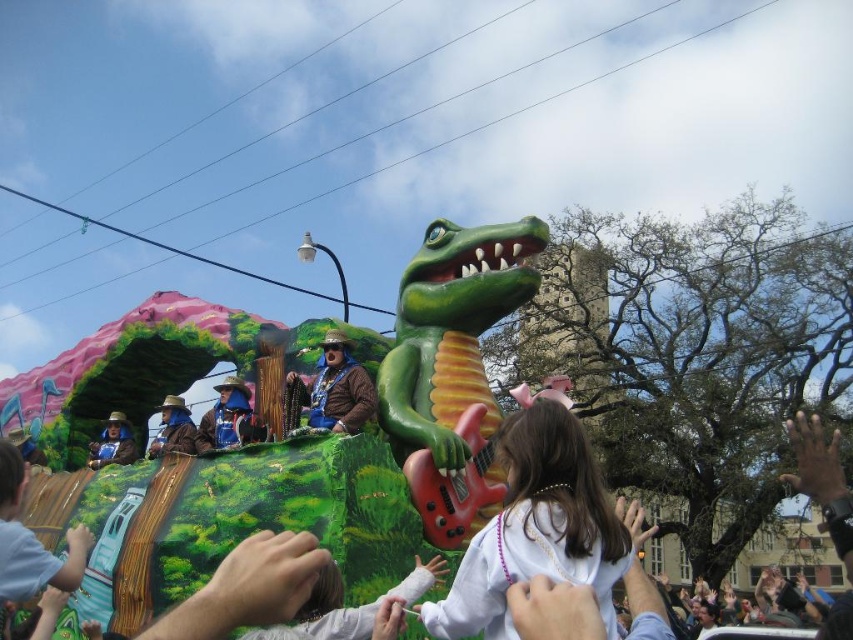
Is blue fabric hat at center to the right of blue velvet hat at center from the viewer's perspective?

Correct, you'll find blue fabric hat at center to the right of blue velvet hat at center.

Does blue fabric hat at center have a smaller size compared to blue velvet hat at center?

Yes.

At what (x,y) coordinates should I click in order to perform the action: click on blue fabric hat at center. Please return your answer as a coordinate pair (x, y). Image resolution: width=853 pixels, height=640 pixels. Looking at the image, I should click on (225, 417).

Is brown leather jacket at center closer to the viewer compared to blue fabric hat at center?

Yes, brown leather jacket at center is closer to the viewer.

The image size is (853, 640). What are the coordinates of `brown leather jacket at center` in the screenshot? It's located at (331, 390).

The height and width of the screenshot is (640, 853). I want to click on brown leather jacket at center, so click(x=331, y=390).

Based on the photo, measure the distance between white pearl necklace at center and camera.

They are 143.41 feet apart.

Does white pearl necklace at center come behind brown leather jacket at center?

No, white pearl necklace at center is in front of brown leather jacket at center.

What do you see at coordinates (549, 536) in the screenshot? I see `white pearl necklace at center` at bounding box center [549, 536].

The height and width of the screenshot is (640, 853). I want to click on white pearl necklace at center, so click(x=549, y=536).